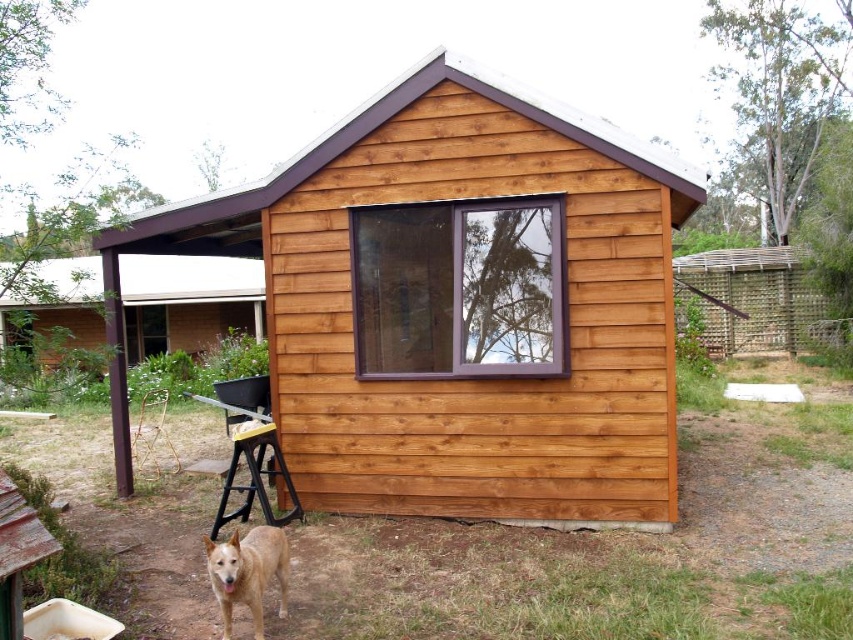
Question: Does natural wood cabin at center have a lesser width compared to golden fur dog at lower left?

Choices:
 (A) no
 (B) yes

Answer: (A)

Question: Does brown wooden cabin at left appear over golden fur dog at lower left?

Choices:
 (A) no
 (B) yes

Answer: (B)

Question: Among these objects, which one is nearest to the camera?

Choices:
 (A) yellow plastic stool at lower center
 (B) natural wood cabin at center
 (C) golden fur dog at lower left
 (D) brown wooden cabin at left

Answer: (C)

Question: Among these objects, which one is nearest to the camera?

Choices:
 (A) yellow plastic stool at lower center
 (B) natural wood cabin at center
 (C) golden fur dog at lower left
 (D) brown wooden cabin at left

Answer: (C)

Question: Considering the real-world distances, which object is farthest from the brown wooden cabin at left?

Choices:
 (A) golden fur dog at lower left
 (B) natural wood cabin at center

Answer: (A)

Question: Is brown wooden cabin at left positioned behind yellow plastic stool at lower center?

Choices:
 (A) no
 (B) yes

Answer: (B)